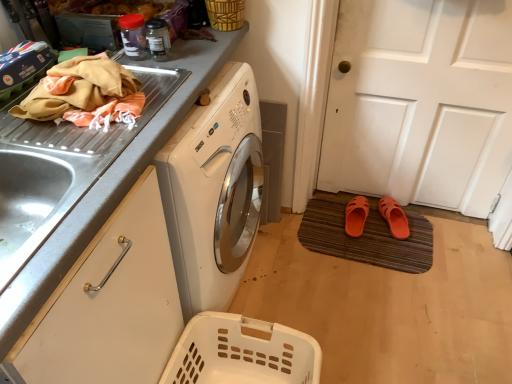
This screenshot has height=384, width=512. I want to click on free region on the left part of brown textured doormat at lower right, so click(x=279, y=261).